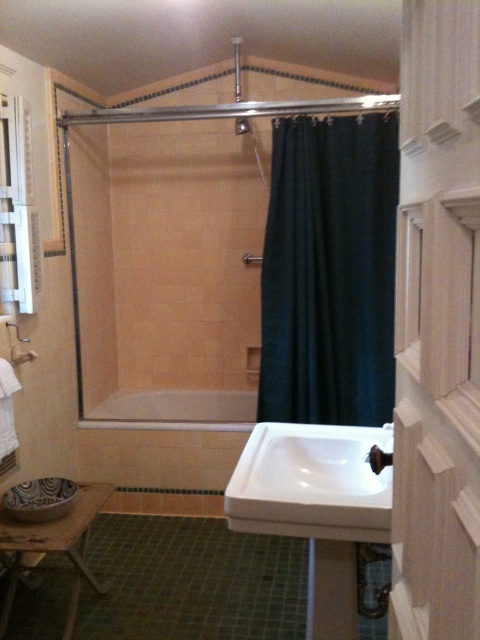
Question: Based on their relative distances, which object is nearer to the white glossy sink at center?

Choices:
 (A) white wood screen door at center
 (B) white matte towel bar at left
 (C) wooden stool at lower left
 (D) dark green fabric at center

Answer: (A)

Question: Can you confirm if dark green fabric at center is wider than white matte towel bar at left?

Choices:
 (A) no
 (B) yes

Answer: (B)

Question: Which object appears farthest from the camera in this image?

Choices:
 (A) wooden stool at lower left
 (B) white glossy bathtub at center
 (C) white matte towel bar at left
 (D) white wood screen door at center

Answer: (B)

Question: Does white wood screen door at center appear under white matte towel bar at left?

Choices:
 (A) no
 (B) yes

Answer: (A)

Question: Which object is positioned closest to the dark green fabric at center?

Choices:
 (A) white ceramic faucet at lower center
 (B) white glossy bathtub at center

Answer: (B)

Question: Does wooden stool at lower left have a lesser width compared to white matte towel bar at left?

Choices:
 (A) yes
 (B) no

Answer: (B)